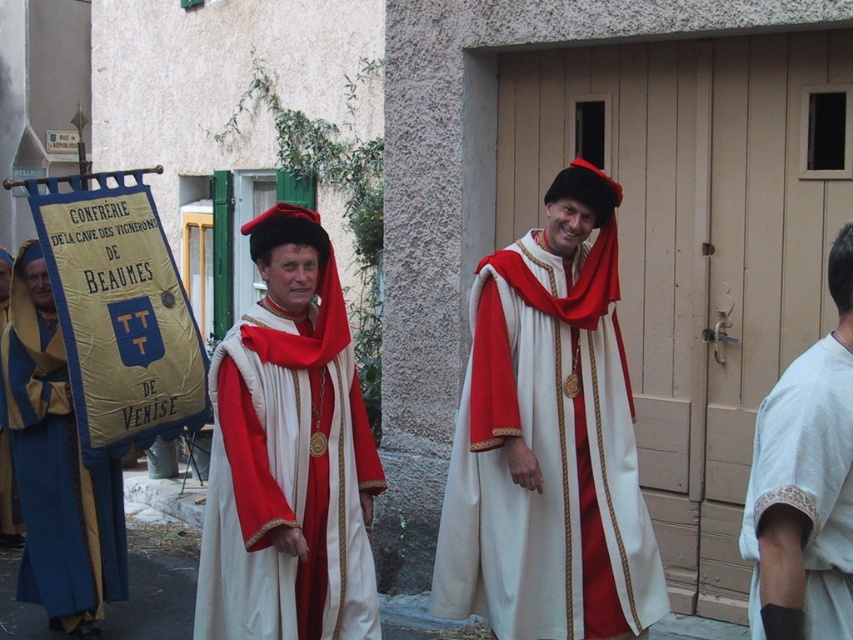
You are a photographer standing at the entrance of the wooden door in the background. You want to take a photo of the two people in red and white robes. The camera you have can only focus on objects within 2 meters. Will both the person holding the banner and the white cotton shirt at right be in focus?

The two people are 2.51 meters apart, which is beyond the camera focus range of 2 meters. Therefore, both cannot be in focus at the same time.

You are an event planner organizing a medieval fair and need to arrange two performers wearing the matte white robe at center and the white cotton shirt at right. Based on their positions in the image, which performer should be placed to the left of the other when setting up the stage?

The matte white robe at center is positioned on the left side of white cotton shirt at right, so the performer in the matte white robe at center should be placed to the left of the performer in the white cotton shirt at right.